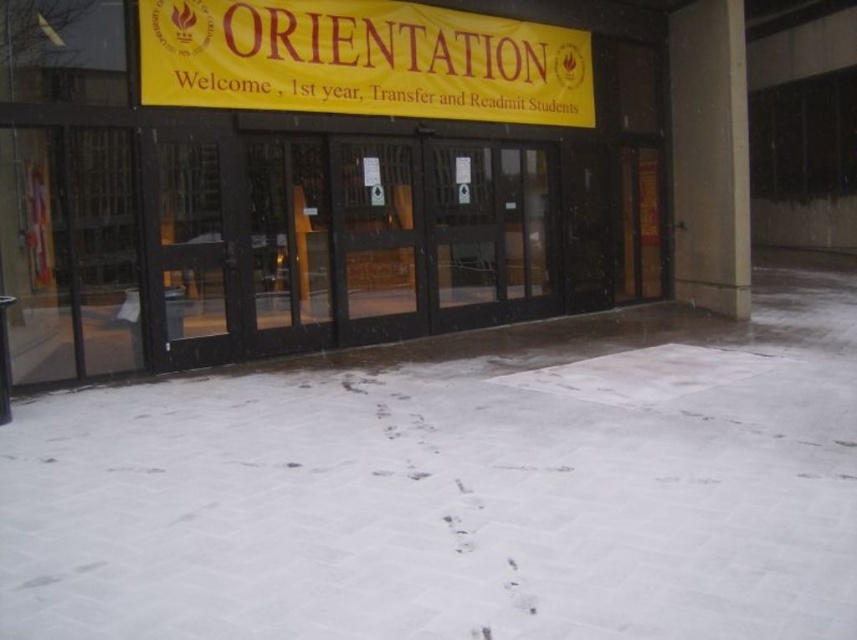
You are a student trying to enter the building through the black glass doors at center. There is white powdery snow at center in your path. Which direction should you move to avoid stepping on the snow?

The white powdery snow at center is positioned on the right side of the black glass doors at center, so you should move to the left to avoid stepping on the snow.

You are standing at the entrance of the building and see two points marked on the floor. The first point is at coordinate point (x=267, y=381) and the second is at point (x=495, y=115). If you want to walk from the first point to the second point, which direction should you move relative to the building entrance?

To move from point (x=267, y=381) to point (x=495, y=115), you should move towards the left and backward since point (x=267, y=381) is in front of point (x=495, y=115).